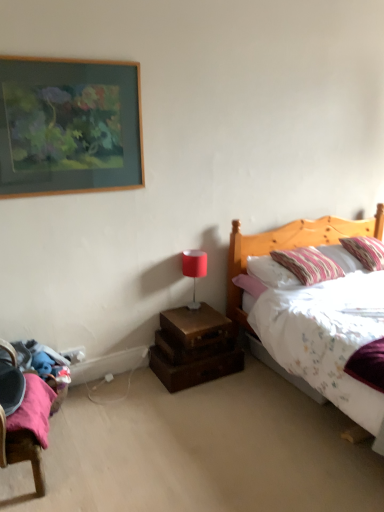
Question: Is wooden nightstand at lower center to the right of wooden picture frame at upper left from the viewer's perspective?

Choices:
 (A) yes
 (B) no

Answer: (A)

Question: From the image's perspective, does wooden nightstand at lower center appear higher than wooden picture frame at upper left?

Choices:
 (A) no
 (B) yes

Answer: (A)

Question: Is wooden nightstand at lower center looking in the opposite direction of wooden picture frame at upper left?

Choices:
 (A) yes
 (B) no

Answer: (B)

Question: From a real-world perspective, is wooden nightstand at lower center below wooden picture frame at upper left?

Choices:
 (A) yes
 (B) no

Answer: (A)

Question: Can you confirm if wooden nightstand at lower center is positioned to the left of wooden picture frame at upper left?

Choices:
 (A) no
 (B) yes

Answer: (A)

Question: In terms of height, does striped fabric pillow at upper right, the 2th pillow when ordered from right to left, look taller or shorter compared to wooden picture frame at upper left?

Choices:
 (A) tall
 (B) short

Answer: (B)

Question: Looking at their shapes, would you say striped fabric pillow at upper right, the 2th pillow when ordered from right to left, is wider or thinner than wooden picture frame at upper left?

Choices:
 (A) wide
 (B) thin

Answer: (A)

Question: From the image's perspective, is striped fabric pillow at upper right, which is the first pillow from left to right, positioned above or below wooden picture frame at upper left?

Choices:
 (A) above
 (B) below

Answer: (B)

Question: Is striped fabric pillow at upper right, the 2th pillow when ordered from right to left, spatially inside wooden picture frame at upper left, or outside of it?

Choices:
 (A) inside
 (B) outside

Answer: (B)

Question: Looking at the image, does wooden nightstand at lower center seem bigger or smaller compared to striped fabric pillow at upper right, which ranks as the 1th pillow in right-to-left order?

Choices:
 (A) small
 (B) big

Answer: (A)

Question: Is wooden nightstand at lower center situated inside striped fabric pillow at upper right, which ranks as the 1th pillow in right-to-left order, or outside?

Choices:
 (A) outside
 (B) inside

Answer: (A)

Question: From the image's perspective, is wooden nightstand at lower center positioned above or below striped fabric pillow at upper right, which ranks as the 1th pillow in right-to-left order?

Choices:
 (A) above
 (B) below

Answer: (B)

Question: Is point (183, 361) closer or farther from the camera than point (355, 248)?

Choices:
 (A) farther
 (B) closer

Answer: (B)

Question: Considering the positions of striped fabric pillow at upper right, the second pillow viewed from the left, and wooden trunk at lower center in the image, is striped fabric pillow at upper right, the second pillow viewed from the left, bigger or smaller than wooden trunk at lower center?

Choices:
 (A) big
 (B) small

Answer: (A)

Question: Looking at their shapes, would you say striped fabric pillow at upper right, which ranks as the 1th pillow in right-to-left order, is wider or thinner than wooden trunk at lower center?

Choices:
 (A) thin
 (B) wide

Answer: (B)